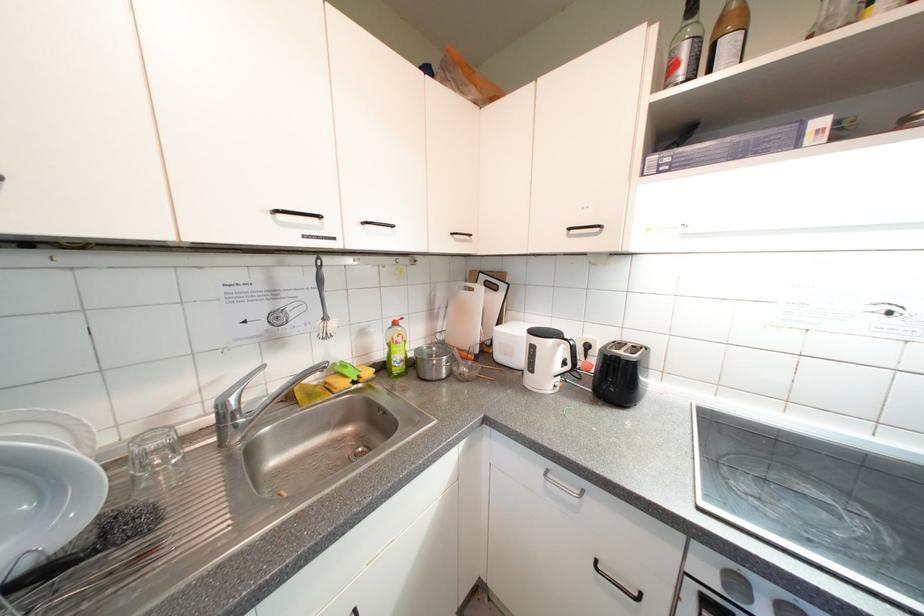
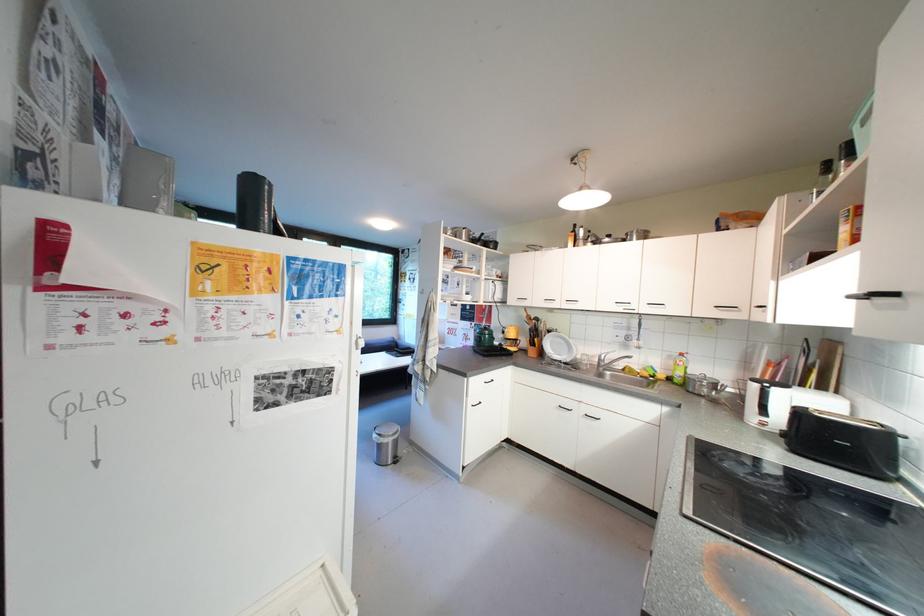
In the second image, find the point that corresponds to [285,214] in the first image.

(624, 305)